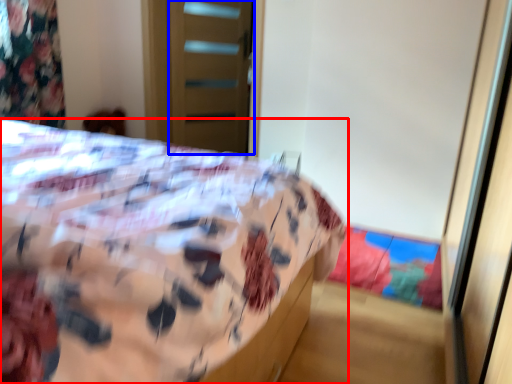
Question: Which object appears closest to the camera in this image, bed (highlighted by a red box) or screen door (highlighted by a blue box)?

Choices:
 (A) bed
 (B) screen door

Answer: (A)